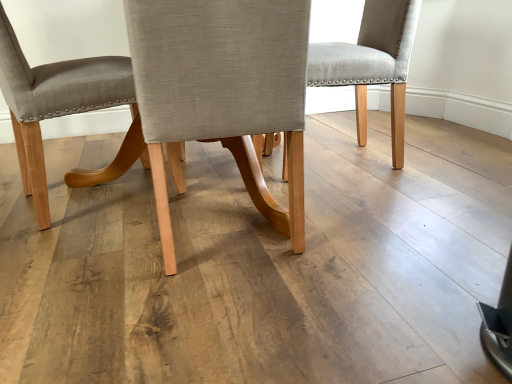
The width and height of the screenshot is (512, 384). I want to click on unoccupied region to the right of light gray fabric chair at center, marked as the 2th chair in a right-to-left arrangement, so click(x=380, y=228).